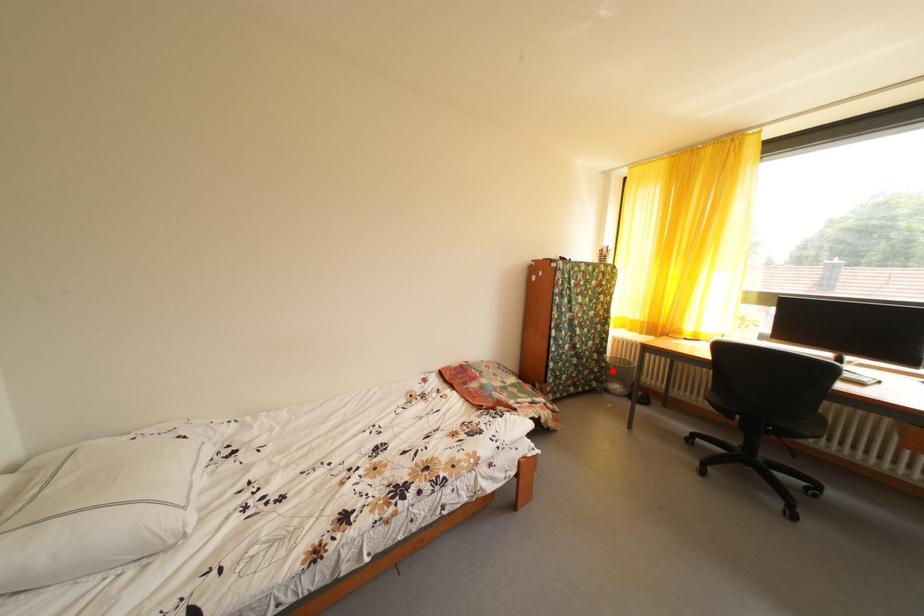
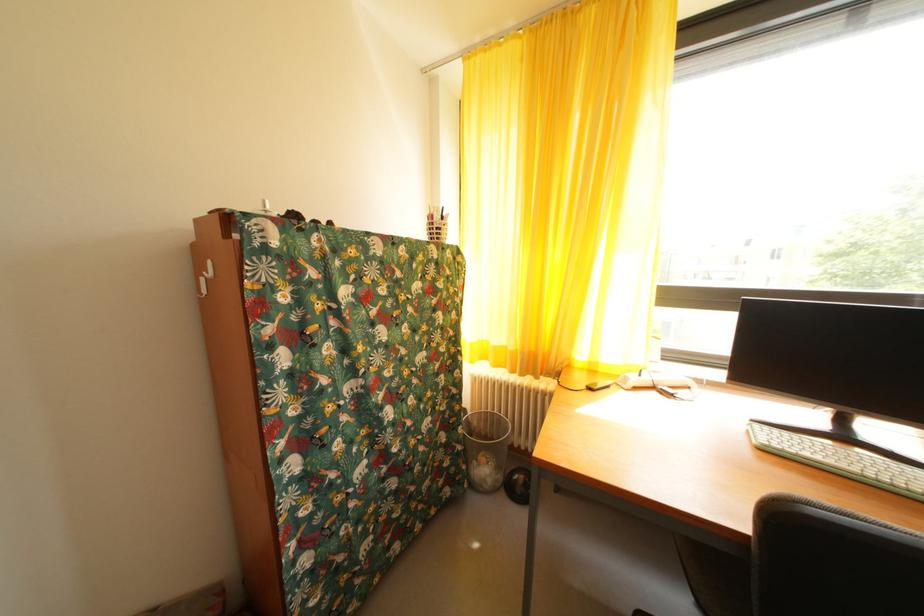
Where in the second image is the point corresponding to the highlighted location from the first image?

(468, 454)